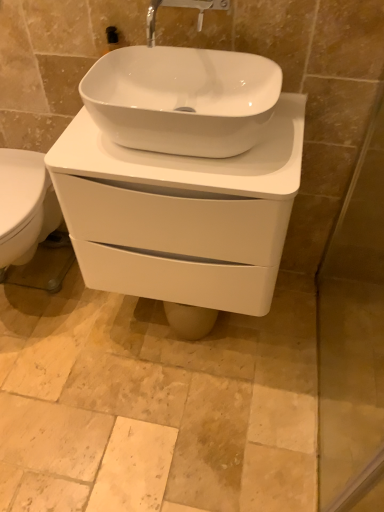
At what (x,y) coordinates should I click in order to perform the action: click on white glossy porcelain at center. Please return your answer as a coordinate pair (x, y). The width and height of the screenshot is (384, 512). Looking at the image, I should click on (181, 218).

What do you see at coordinates (181, 218) in the screenshot? The width and height of the screenshot is (384, 512). I see `white glossy porcelain at center` at bounding box center [181, 218].

Where is `transparent glass screen door at right`? The width and height of the screenshot is (384, 512). transparent glass screen door at right is located at coordinates (353, 326).

Identify the location of white glossy porcelain at center. This screenshot has width=384, height=512. (181, 218).

From the picture: From a real-world perspective, between matte silver faucet at upper center and white glossy sink at center, who is vertically higher?

In real-world perspective, matte silver faucet at upper center is above.

Which is correct: matte silver faucet at upper center is inside white glossy sink at center, or outside of it?

matte silver faucet at upper center exists outside the volume of white glossy sink at center.

Is matte silver faucet at upper center situated inside white glossy porcelain at center or outside?

matte silver faucet at upper center is outside white glossy porcelain at center.

In the scene shown: Who is taller, matte silver faucet at upper center or white glossy porcelain at center?

white glossy porcelain at center is taller.

Is matte silver faucet at upper center turned away from white glossy porcelain at center?

No, white glossy porcelain at center is not at the back of matte silver faucet at upper center.

Which is more to the right, transparent glass screen door at right or white glossy sink at center?

From the viewer's perspective, transparent glass screen door at right appears more on the right side.

I want to click on screen door on the right of white glossy sink at center, so click(x=353, y=326).

Does transparent glass screen door at right have a lesser width compared to white glossy sink at center?

Yes.

Is white glossy sink at center thinner than transparent glass screen door at right?

Incorrect, the width of white glossy sink at center is not less than that of transparent glass screen door at right.

Which is nearer, (193, 103) or (345, 410)?

The point (193, 103) is closer to the camera.

Is white glossy sink at center aimed at transparent glass screen door at right?

No, white glossy sink at center does not turn towards transparent glass screen door at right.

From a real-world perspective, is matte silver faucet at upper center physically below transparent glass screen door at right?

No, from a real-world perspective, matte silver faucet at upper center is not under transparent glass screen door at right.

Can you tell me how much matte silver faucet at upper center and transparent glass screen door at right differ in facing direction?

The angle between the facing direction of matte silver faucet at upper center and the facing direction of transparent glass screen door at right is 90.9 degrees.

How distant is matte silver faucet at upper center from transparent glass screen door at right?

They are 37.66 inches apart.

Which is more to the right, matte silver faucet at upper center or transparent glass screen door at right?

transparent glass screen door at right.

Relative to transparent glass screen door at right, is white glossy porcelain at center in front or behind?

Visually, white glossy porcelain at center is located behind transparent glass screen door at right.

Considering the sizes of white glossy porcelain at center and transparent glass screen door at right in the image, is white glossy porcelain at center bigger or smaller than transparent glass screen door at right?

Clearly, white glossy porcelain at center is larger in size than transparent glass screen door at right.

Is white glossy porcelain at center wider than transparent glass screen door at right?

Yes.

Considering the points (260, 292) and (319, 496), which point is in front, point (260, 292) or point (319, 496)?

Positioned in front is point (319, 496).

Is transparent glass screen door at right facing away from matte silver faucet at upper center?

transparent glass screen door at right is not turned away from matte silver faucet at upper center.

Is transparent glass screen door at right situated inside matte silver faucet at upper center or outside?

The correct answer is: outside.

Which of these two, transparent glass screen door at right or matte silver faucet at upper center, is smaller?

matte silver faucet at upper center is smaller.

This screenshot has width=384, height=512. Find the location of `tap above the white glossy sink at center (from a real-world perspective)`. tap above the white glossy sink at center (from a real-world perspective) is located at coordinates (181, 7).

What are the coordinates of `porcelain in front of the matte silver faucet at upper center` in the screenshot? It's located at (181, 218).

Estimate the real-world distances between objects in this image. Which object is closer to white glossy porcelain at center, transparent glass screen door at right or white glossy sink at center?

white glossy sink at center is positioned closer to the anchor white glossy porcelain at center.

Considering their positions, is white glossy sink at center positioned closer to matte silver faucet at upper center than white glossy porcelain at center?

Based on the image, white glossy sink at center appears to be nearer to matte silver faucet at upper center.

When comparing their distances from matte silver faucet at upper center, does transparent glass screen door at right or white glossy sink at center seem further?

Based on the image, transparent glass screen door at right appears to be further to matte silver faucet at upper center.

Considering their positions, is white glossy sink at center positioned closer to transparent glass screen door at right than matte silver faucet at upper center?

The object closer to transparent glass screen door at right is white glossy sink at center.

Estimate the real-world distances between objects in this image. Which object is further from white glossy porcelain at center, white glossy sink at center or transparent glass screen door at right?

The object further to white glossy porcelain at center is transparent glass screen door at right.

From the image, which object appears to be farther from transparent glass screen door at right, matte silver faucet at upper center or white glossy sink at center?

matte silver faucet at upper center.

From the image, which object appears to be nearer to transparent glass screen door at right, matte silver faucet at upper center or white glossy porcelain at center?

white glossy porcelain at center lies closer to transparent glass screen door at right than the other object.

From the picture: Which object lies nearer to the anchor point transparent glass screen door at right, white glossy porcelain at center or white glossy sink at center?

Among the two, white glossy porcelain at center is located nearer to transparent glass screen door at right.

Locate an element on the screen. Image resolution: width=384 pixels, height=512 pixels. sink between matte silver faucet at upper center and white glossy porcelain at center from top to bottom is located at coordinates (181, 97).

Identify the location of sink between matte silver faucet at upper center and transparent glass screen door at right in the vertical direction. The image size is (384, 512). (181, 97).

This screenshot has width=384, height=512. What are the coordinates of `porcelain between white glossy sink at center and transparent glass screen door at right from left to right` in the screenshot? It's located at (181, 218).

The image size is (384, 512). I want to click on porcelain between matte silver faucet at upper center and transparent glass screen door at right in the up-down direction, so click(x=181, y=218).